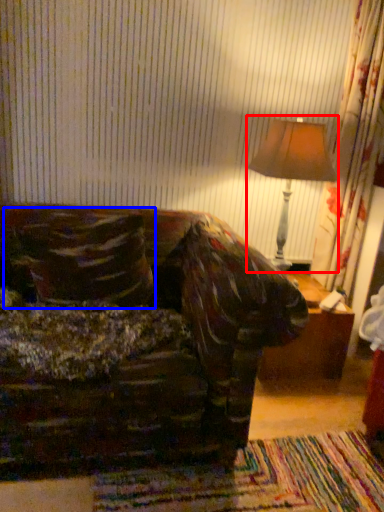
Question: Which of the following is the closest to the observer, table lamp (highlighted by a red box) or throw pillow (highlighted by a blue box)?

Choices:
 (A) table lamp
 (B) throw pillow

Answer: (B)